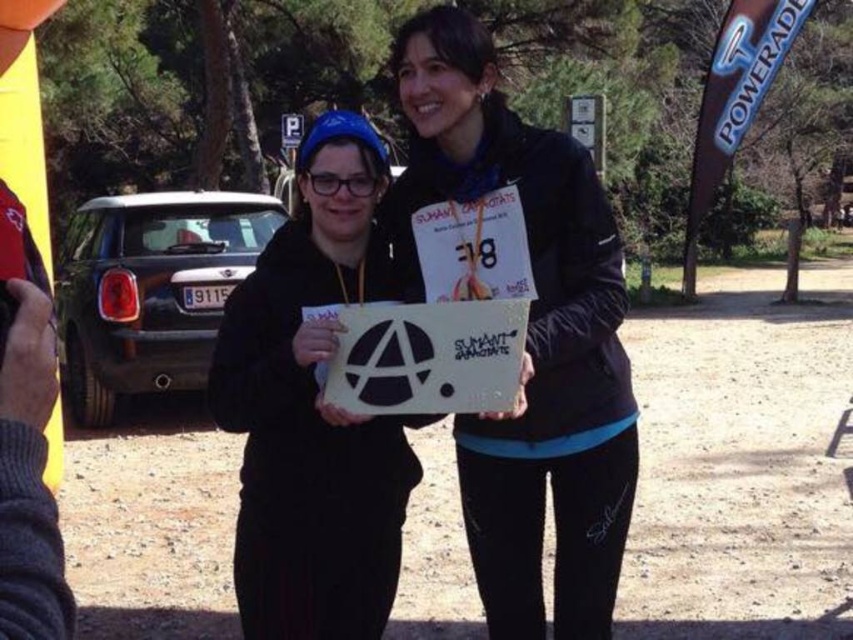
Does black matte hoodie at center have a lesser width compared to white matte sign at center?

No, black matte hoodie at center is not thinner than white matte sign at center.

Between black matte hoodie at center and white matte sign at center, which one has more height?

Standing taller between the two is black matte hoodie at center.

Does point (334, 237) come farther from viewer compared to point (479, 348)?

Yes, point (334, 237) is farther from viewer.

The height and width of the screenshot is (640, 853). What are the coordinates of `black matte hoodie at center` in the screenshot? It's located at (312, 408).

Can you confirm if black matte jacket at center is positioned above white matte sign at center?

No, black matte jacket at center is not above white matte sign at center.

What do you see at coordinates (527, 337) in the screenshot? The width and height of the screenshot is (853, 640). I see `black matte jacket at center` at bounding box center [527, 337].

Is point (523, 417) positioned behind point (367, 406)?

Yes, it is behind point (367, 406).

Find the location of a particular element. black matte jacket at center is located at coordinates (527, 337).

How far apart are black matte jacket at center and black matte hoodie at center?

They are 37.17 centimeters apart.

Does black matte jacket at center have a smaller size compared to black matte hoodie at center?

No, black matte jacket at center is not smaller than black matte hoodie at center.

You are a GUI agent. You are given a task and a screenshot of the screen. Output one action in this format:
    pyautogui.click(x=<x>, y=<y>)
    Task: Click on the black matte jacket at center
    This screenshot has width=853, height=640.
    Given the screenshot: What is the action you would take?
    pyautogui.click(x=527, y=337)